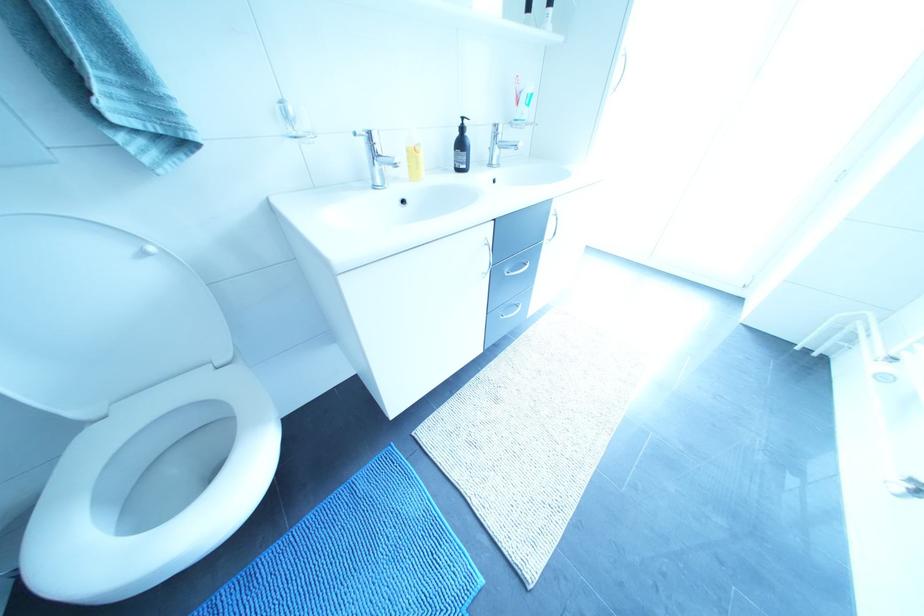
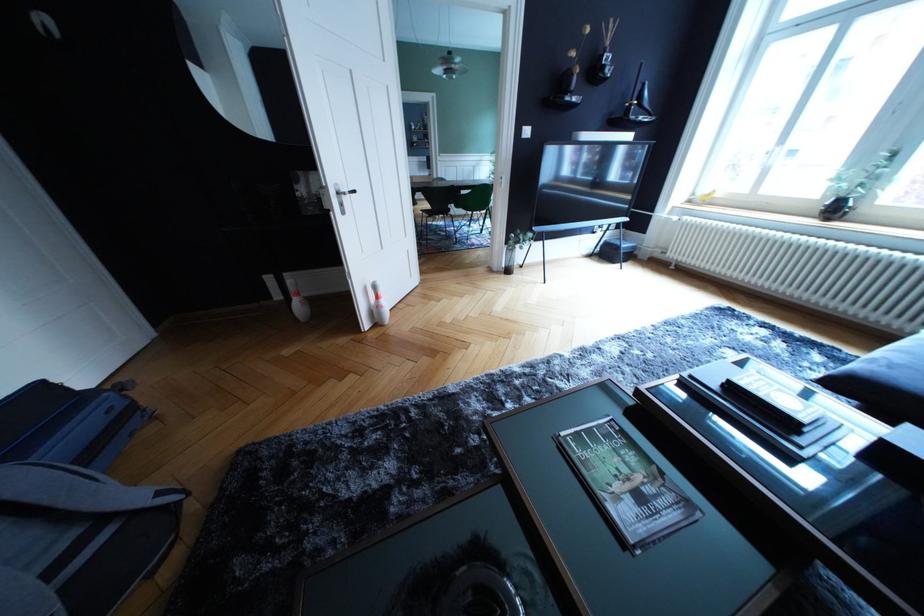
Question: I am providing you with two images of the same scene from different viewpoints. After the viewpoint changes to image2, which objects are now occluded?

Choices:
 (A) white door handle
 (B) silver drawer handle
 (C) green handle
 (D) sofa armrest

Answer: (B)